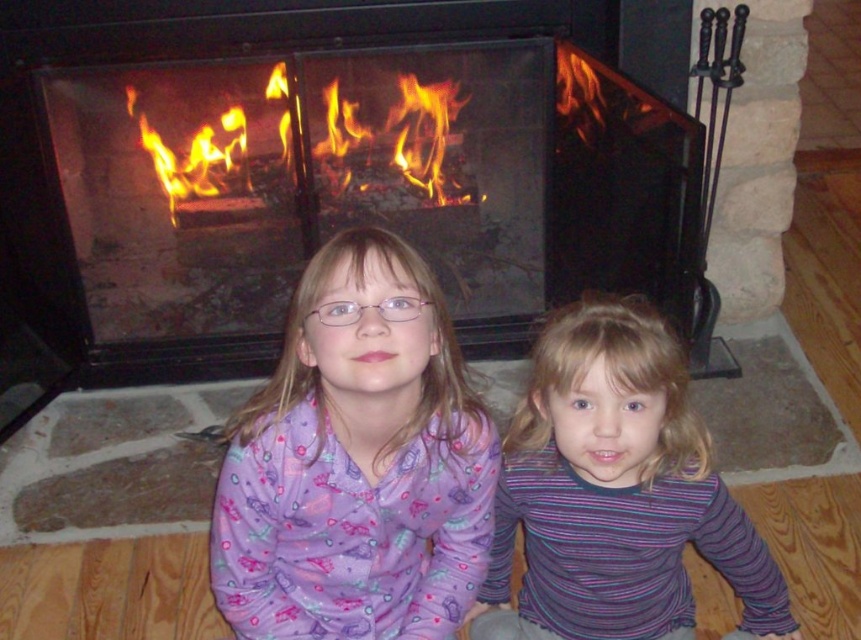
Does smooth stone fireplace at center appear on the left side of striped fabric shirt at center?

Yes, smooth stone fireplace at center is to the left of striped fabric shirt at center.

Does point (237, 72) come closer to viewer compared to point (796, 630)?

No, (237, 72) is further to viewer.

This screenshot has width=861, height=640. What are the coordinates of `smooth stone fireplace at center` in the screenshot? It's located at (321, 170).

Who is positioned more to the right, purple fabric shirt at center or black wrought iron fireplace tools at right?

black wrought iron fireplace tools at right is more to the right.

From the picture: Does purple fabric shirt at center have a lesser height compared to black wrought iron fireplace tools at right?

Yes, purple fabric shirt at center is shorter than black wrought iron fireplace tools at right.

Who is more forward, [406,499] or [723,12]?

Positioned in front is point [406,499].

Identify the location of purple fabric shirt at center. (356, 464).

Who is lower down, flamewoodenfire at center or black wrought iron fireplace tools at right?

Positioned lower is black wrought iron fireplace tools at right.

Between flamewoodenfire at center and black wrought iron fireplace tools at right, which one has more height?

black wrought iron fireplace tools at right

This screenshot has width=861, height=640. I want to click on flamewoodenfire at center, so click(395, 134).